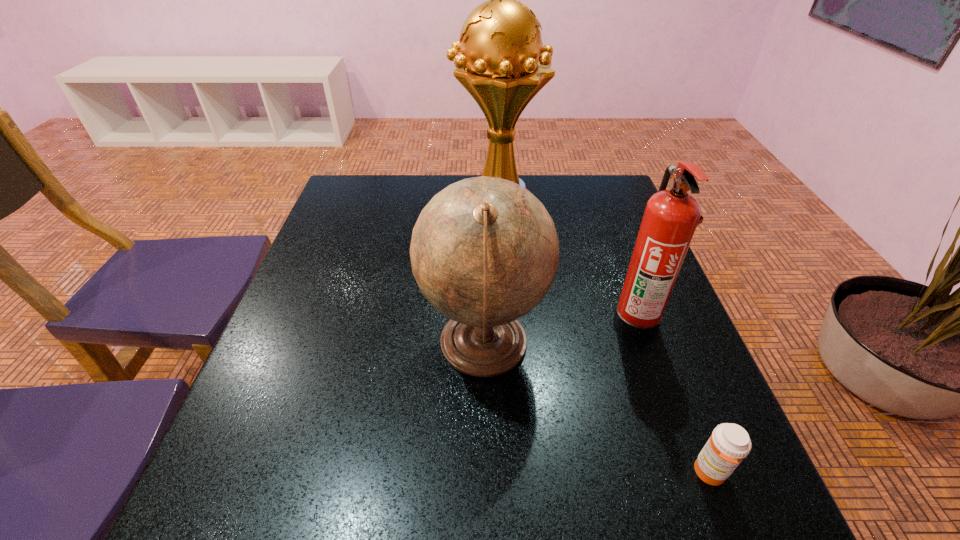
At what (x,y) coordinates should I click in order to perform the action: click on vacant position in the image that satisfies the following two spatial constraints: 1. with the nozzle pointing from the back of the fire extinguisher; 2. on the left side of the shortest object. Please return your answer as a coordinate pair (x, y). This screenshot has width=960, height=540. Looking at the image, I should click on (688, 473).

Locate an element on the screen. free region that satisfies the following two spatial constraints: 1. at the front of the nearest object where the globe is prominent; 2. on the right side of the trophy_cup is located at coordinates (511, 473).

In order to click on free region that satisfies the following two spatial constraints: 1. at the front of the trophy_cup where the globe is prominent; 2. on the back side of the shortest object in this screenshot , I will do `click(511, 473)`.

What are the coordinates of `vacant region that satisfies the following two spatial constraints: 1. at the front of the trophy_cup where the globe is prominent; 2. on the left side of the nearest object` in the screenshot? It's located at (511, 473).

The image size is (960, 540). What are the coordinates of `free space that satisfies the following two spatial constraints: 1. at the front of the shortest object where the globe is prominent; 2. on the right side of the tallest object` in the screenshot? It's located at (511, 473).